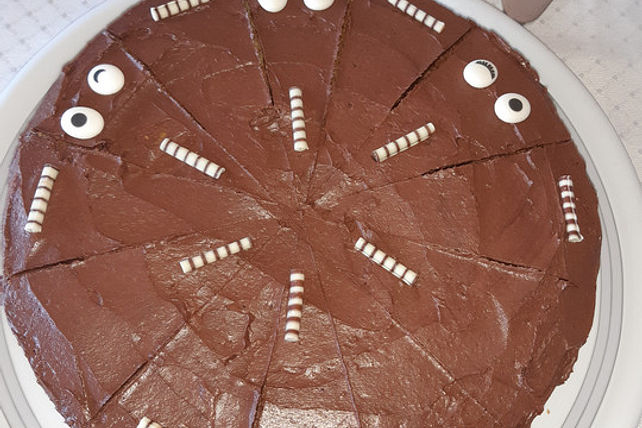
The image size is (642, 428). I want to click on background tablecloth, so click(26, 3), click(620, 46).